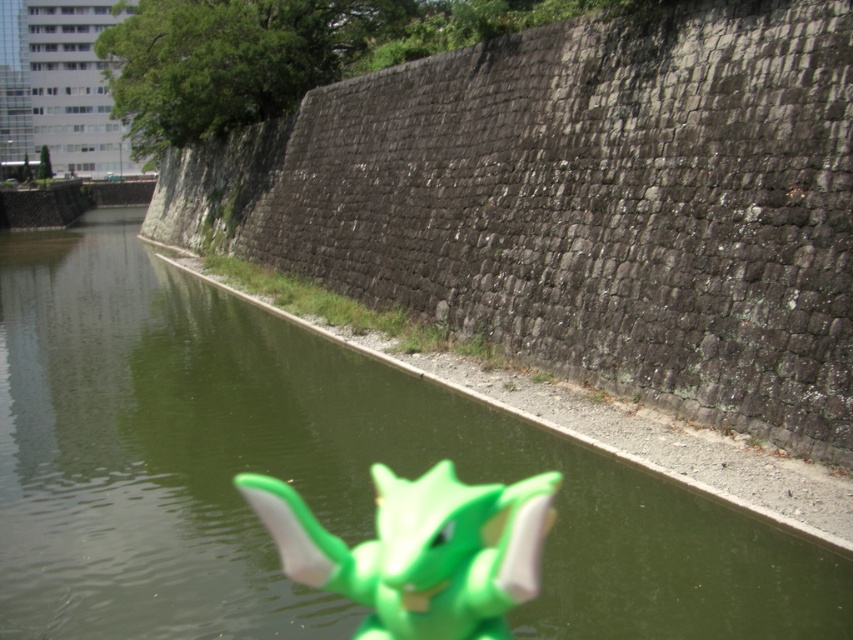
Question: Which object is farther from the camera taking this photo?

Choices:
 (A) green plastic river at center
 (B) green matte toy at center

Answer: (A)

Question: Where is green plastic river at center located in relation to green matte toy at center in the image?

Choices:
 (A) above
 (B) below

Answer: (A)

Question: Is green plastic river at center below green matte toy at center?

Choices:
 (A) no
 (B) yes

Answer: (A)

Question: Among these objects, which one is farthest from the camera?

Choices:
 (A) green plastic river at center
 (B) green matte toy at center

Answer: (A)

Question: Observing the image, what is the correct spatial positioning of green plastic river at center in reference to green matte toy at center?

Choices:
 (A) left
 (B) right

Answer: (A)